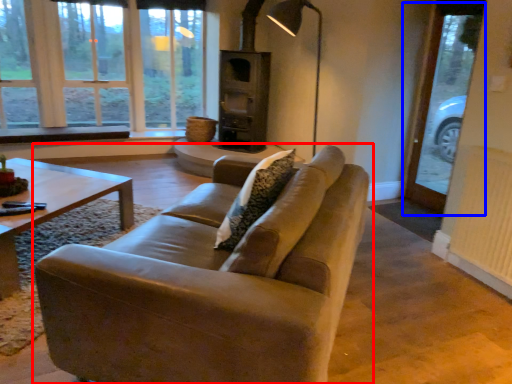
Question: Which of the following is the closest to the observer, studio couch (highlighted by a red box) or screen door (highlighted by a blue box)?

Choices:
 (A) studio couch
 (B) screen door

Answer: (A)